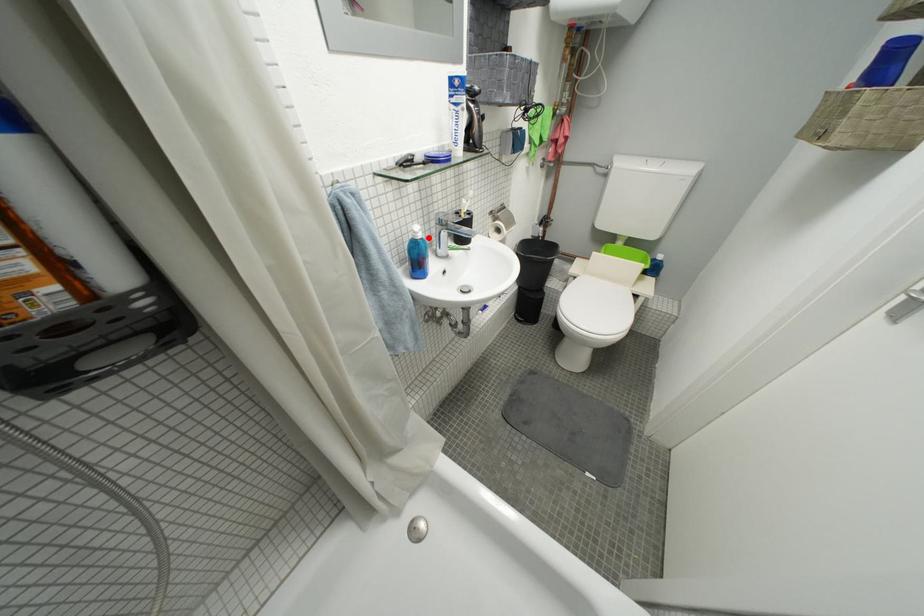
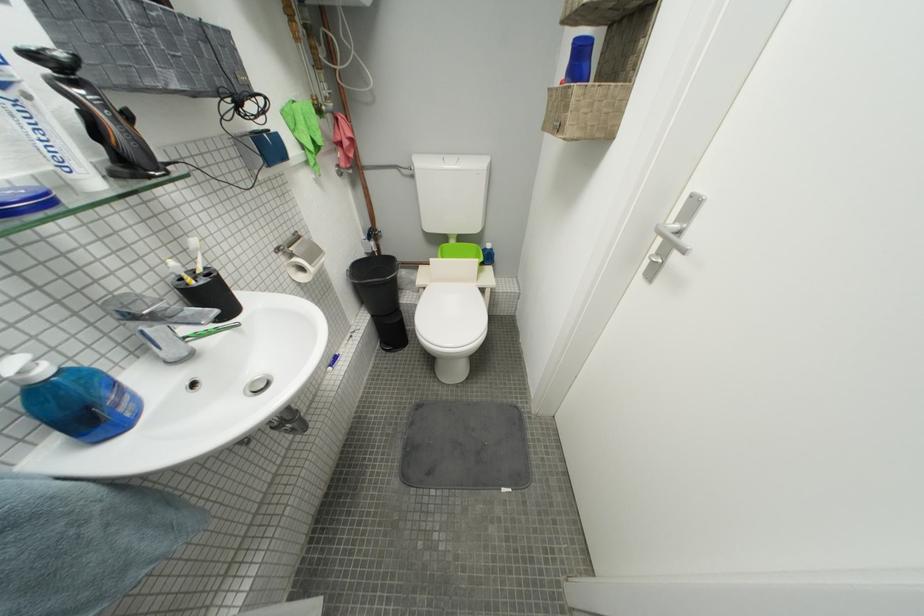
Question: I am providing you with two images of the same scene from different viewpoints. A red point is shown in image1. For the corresponding object point in image2, is it positioned nearer or farther from the camera?

Choices:
 (A) Nearer
 (B) Farther

Answer: (B)